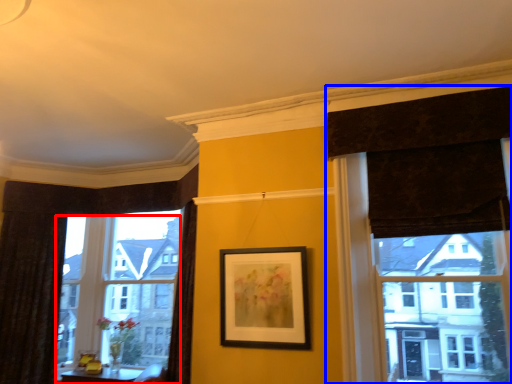
Question: Which point is further to the camera, window (highlighted by a red box) or curtain (highlighted by a blue box)?

Choices:
 (A) window
 (B) curtain

Answer: (A)